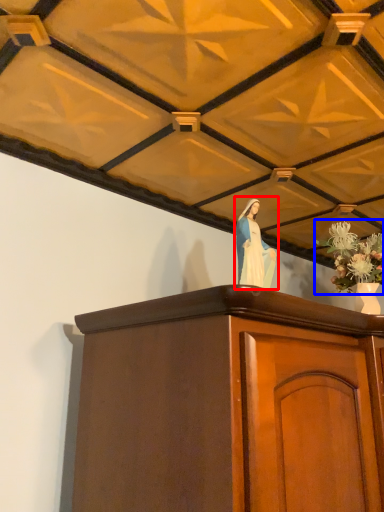
Question: Which object is closer to the camera taking this photo, woman (highlighted by a red box) or floral arrangement (highlighted by a blue box)?

Choices:
 (A) woman
 (B) floral arrangement

Answer: (A)